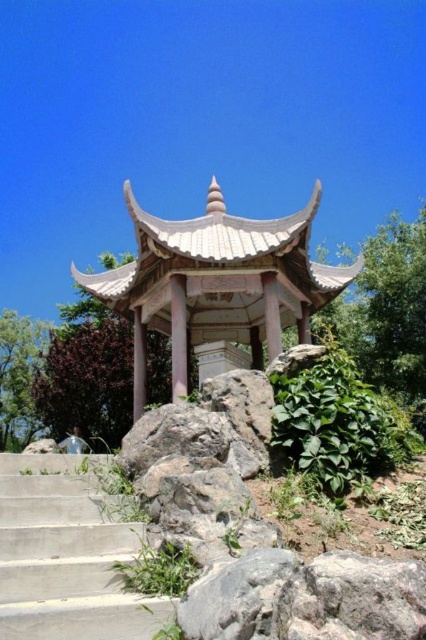
You are standing at the entrance of a garden and want to take a photo of the white stone gazebo at center. If your camera has a maximum zoom range of 10 feet, can you capture the entire gazebo without moving closer?

The white stone gazebo at center is 20.71 feet away from the camera. Since the camera can only zoom up to 10 feet, it cannot capture the entire gazebo without moving closer.

You are standing at point 0,0 in the image coordinate system. You want to go to the white stone gazebo at center. Which direction should you go?

The white stone gazebo at center is located at coordinate point (216, 282), so you should move towards the center of the image to reach it.